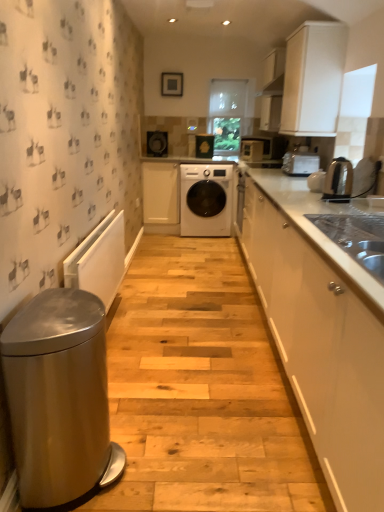
Question: Is metallic silver kettle at right, the second home appliance positioned from the top, aimed at white glossy cabinet at right, which appears as the 2th cabinetry when viewed from the right?

Choices:
 (A) yes
 (B) no

Answer: (B)

Question: Can you confirm if metallic silver kettle at right, the second home appliance positioned from the top, is wider than white glossy cabinet at right, acting as the second cabinetry starting from the left?

Choices:
 (A) yes
 (B) no

Answer: (B)

Question: From the image's perspective, is metallic silver kettle at right, which appears as the 1th home appliance when ordered from the bottom, over white glossy cabinet at right, positioned as the first cabinetry in front-to-back order?

Choices:
 (A) yes
 (B) no

Answer: (A)

Question: Does metallic silver kettle at right, the second home appliance positioned from the top, have a larger size compared to white glossy cabinet at right, which appears as the 2th cabinetry when viewed from the right?

Choices:
 (A) no
 (B) yes

Answer: (A)

Question: From a real-world perspective, does metallic silver kettle at right, the second home appliance positioned from the back, stand above white glossy cabinet at right, which appears as the 2th cabinetry when viewed from the right?

Choices:
 (A) no
 (B) yes

Answer: (B)

Question: Choose the correct answer: Is white glossy cabinet at right, acting as the second cabinetry starting from the left, inside matte black washing machine at center, which is the 2th appliance in left-to-right order, or outside it?

Choices:
 (A) outside
 (B) inside

Answer: (A)

Question: Is white glossy cabinet at right, acting as the second cabinetry starting from the left, bigger or smaller than matte black washing machine at center, marked as the fourth appliance in a front-to-back arrangement?

Choices:
 (A) big
 (B) small

Answer: (A)

Question: Relative to matte black washing machine at center, arranged as the first appliance when viewed from the back, is white glossy cabinet at right, positioned as the first cabinetry in front-to-back order, in front or behind?

Choices:
 (A) behind
 (B) front

Answer: (B)

Question: Considering the positions of point (342, 380) and point (205, 154), is point (342, 380) closer or farther from the camera than point (205, 154)?

Choices:
 (A) closer
 (B) farther

Answer: (A)

Question: Looking at their shapes, would you say satin silver toaster at upper right, the second home appliance positioned from the front, is wider or thinner than matte black speaker at upper center, the 2th appliance in the back-to-front sequence?

Choices:
 (A) thin
 (B) wide

Answer: (B)

Question: From the image's perspective, is satin silver toaster at upper right, the second home appliance positioned from the front, located above or below matte black speaker at upper center, the 2th appliance in the back-to-front sequence?

Choices:
 (A) above
 (B) below

Answer: (B)

Question: Would you say satin silver toaster at upper right, which is the 2th home appliance in bottom-to-top order, is inside or outside matte black speaker at upper center, positioned as the second appliance in top-to-bottom order?

Choices:
 (A) inside
 (B) outside

Answer: (B)

Question: In terms of size, does satin silver toaster at upper right, the second home appliance positioned from the front, appear bigger or smaller than matte black speaker at upper center, which ranks as the first appliance in left-to-right order?

Choices:
 (A) big
 (B) small

Answer: (A)

Question: Looking at the image, does white matte washing machine at center seem bigger or smaller compared to satin silver toaster at upper right, which is the 2th home appliance in bottom-to-top order?

Choices:
 (A) small
 (B) big

Answer: (B)

Question: Is white matte washing machine at center in front of or behind satin silver toaster at upper right, the second home appliance positioned from the front, in the image?

Choices:
 (A) behind
 (B) front

Answer: (A)